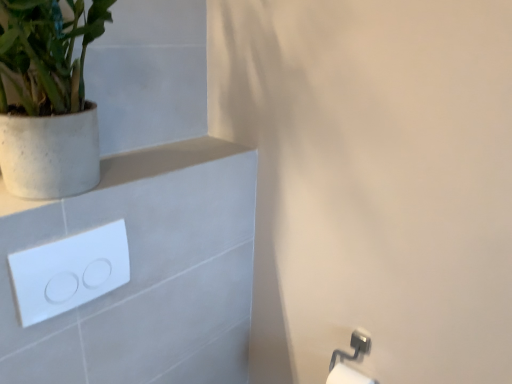
Question: Considering the positions of white speckled concrete pot at upper left and white glossy/light switch at upper left in the image, is white speckled concrete pot at upper left bigger or smaller than white glossy/light switch at upper left?

Choices:
 (A) small
 (B) big

Answer: (B)

Question: From the image's perspective, relative to white glossy/light switch at upper left, is white speckled concrete pot at upper left above or below?

Choices:
 (A) above
 (B) below

Answer: (A)

Question: Which of these objects is positioned closest to the white matte concrete at upper left?

Choices:
 (A) white glossy/light switch at upper left
 (B) white speckled concrete pot at upper left
 (C) white glossy toilet paper at lower right

Answer: (A)

Question: Which of these objects is positioned farthest from the white glossy toilet paper at lower right?

Choices:
 (A) white glossy/light switch at upper left
 (B) white speckled concrete pot at upper left
 (C) white matte concrete at upper left

Answer: (B)